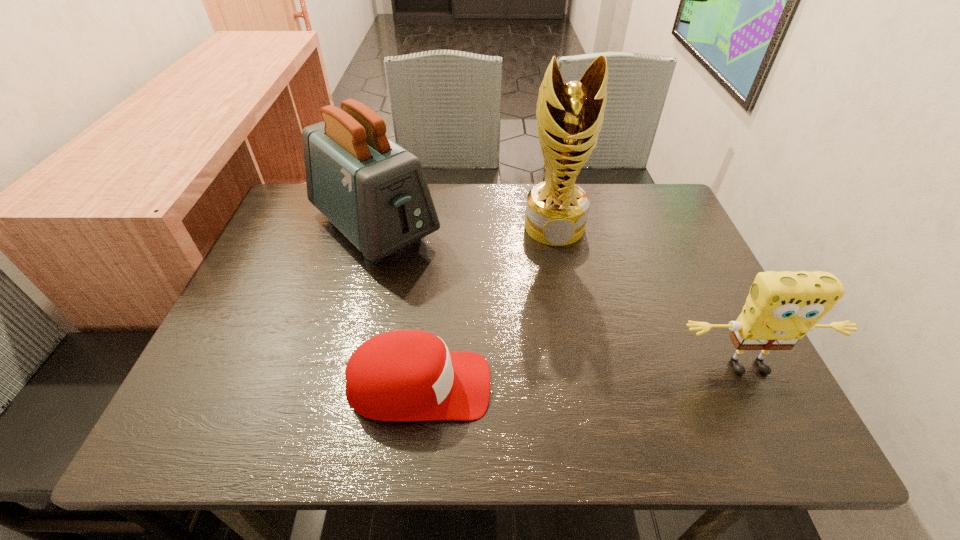
Locate an element on the screen. the shortest object is located at coordinates (405, 375).

Locate an element on the screen. sponge is located at coordinates (781, 308).

I want to click on the third tallest object, so click(781, 308).

Find the location of `the second object from right to left`. the second object from right to left is located at coordinates (569, 117).

The height and width of the screenshot is (540, 960). I want to click on the tallest object, so click(569, 117).

You are a GUI agent. You are given a task and a screenshot of the screen. Output one action in this format:
    pyautogui.click(x=<x>, y=<y>)
    Task: Click on the third shortest object
    The image size is (960, 540).
    Given the screenshot: What is the action you would take?
    pyautogui.click(x=375, y=192)

Where is `vacant space located 0.390m on the front-facing side of the baseball cap`? vacant space located 0.390m on the front-facing side of the baseball cap is located at coordinates (689, 386).

The width and height of the screenshot is (960, 540). Identify the location of vacant region located on the front-facing side of the second object from right to left. (570, 323).

The image size is (960, 540). Find the location of `vacant space located on the front-facing side of the second object from right to left`. vacant space located on the front-facing side of the second object from right to left is located at coordinates (568, 316).

You are a GUI agent. You are given a task and a screenshot of the screen. Output one action in this format:
    pyautogui.click(x=<x>, y=<y>)
    Task: Click on the vacant space located 0.370m on the front-facing side of the second object from right to left
    
    Given the screenshot: What is the action you would take?
    pyautogui.click(x=577, y=366)